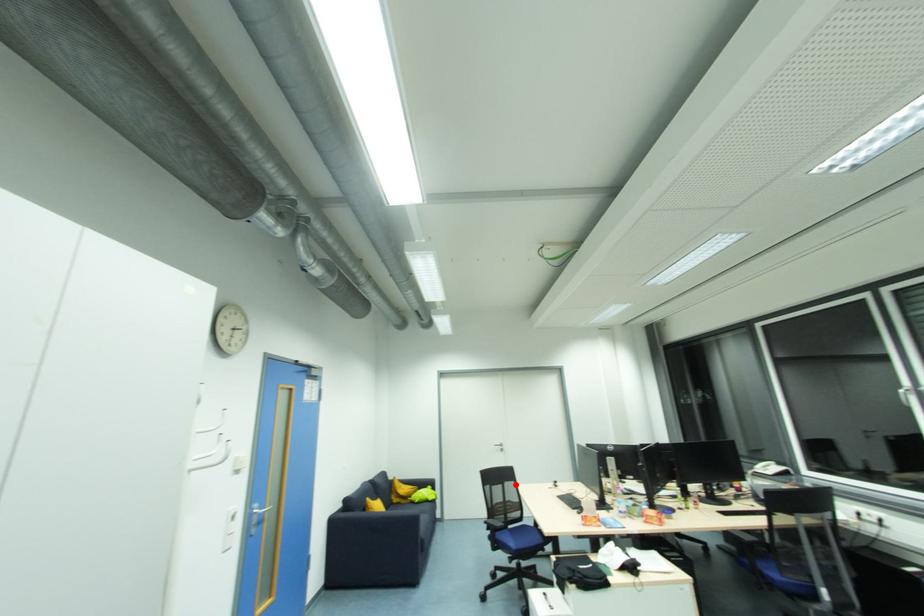
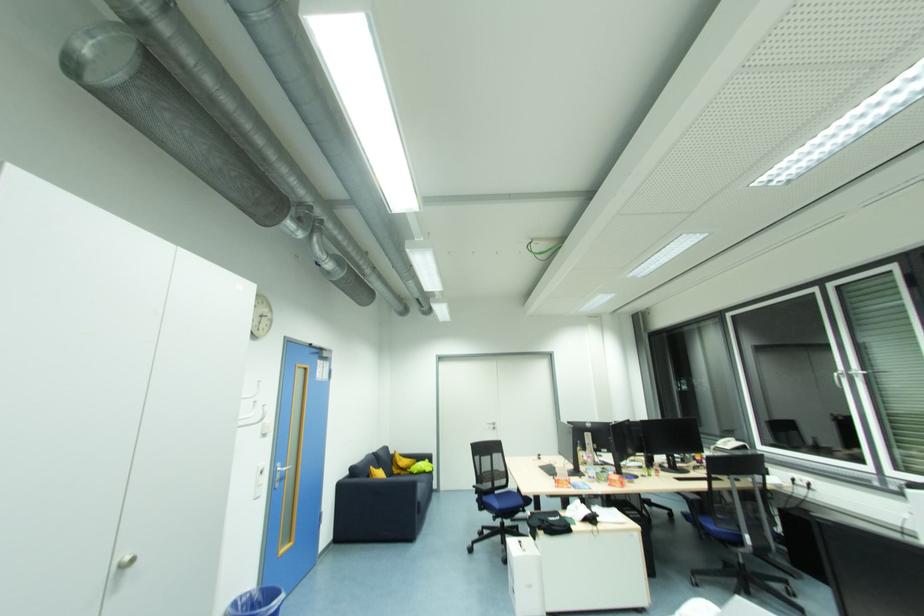
Where in the second image is the point corresponding to the highlighted location from the first image?

(504, 456)